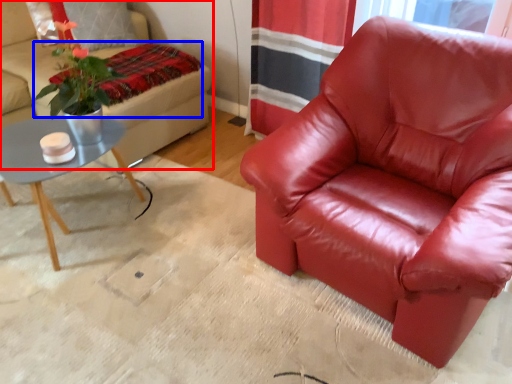
Question: Among these objects, which one is nearest to the camera, studio couch (highlighted by a red box) or blanket (highlighted by a blue box)?

Choices:
 (A) studio couch
 (B) blanket

Answer: (A)